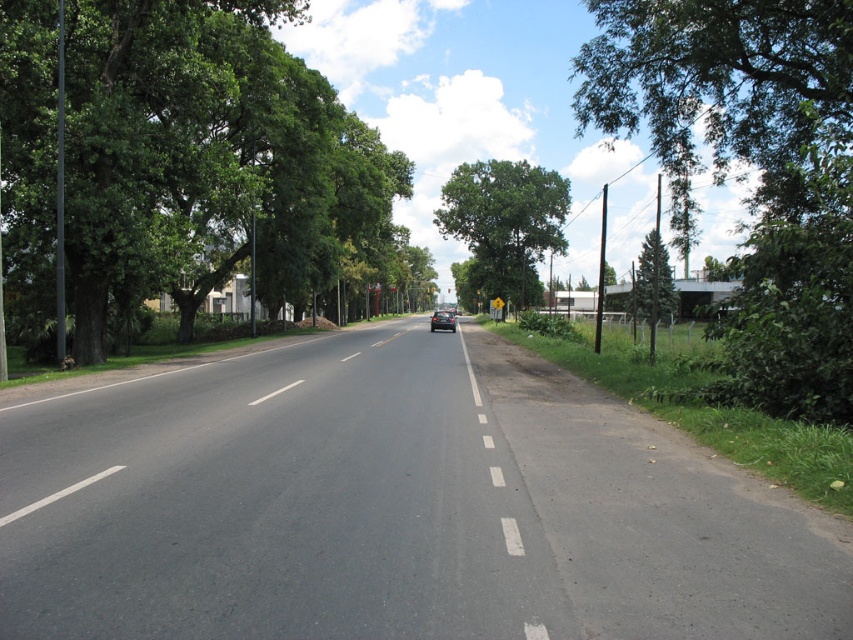
Question: Can you confirm if green leafy tree at right is positioned below green leafy tree at center?

Choices:
 (A) yes
 (B) no

Answer: (B)

Question: Which object is closer to the camera taking this photo?

Choices:
 (A) green leafy tree at right
 (B) green leafy tree at left

Answer: (A)

Question: Does green leafy tree at left appear on the left side of white smooth line at center?

Choices:
 (A) yes
 (B) no

Answer: (A)

Question: Is glossy black car at center below white smooth line at center?

Choices:
 (A) yes
 (B) no

Answer: (B)

Question: Which point is farther to the camera?

Choices:
 (A) (505, 189)
 (B) (24, 292)
 (C) (346, 356)
 (D) (682, 154)

Answer: (A)

Question: Among these points, which one is nearest to the camera?

Choices:
 (A) (497, 298)
 (B) (45, 500)

Answer: (B)